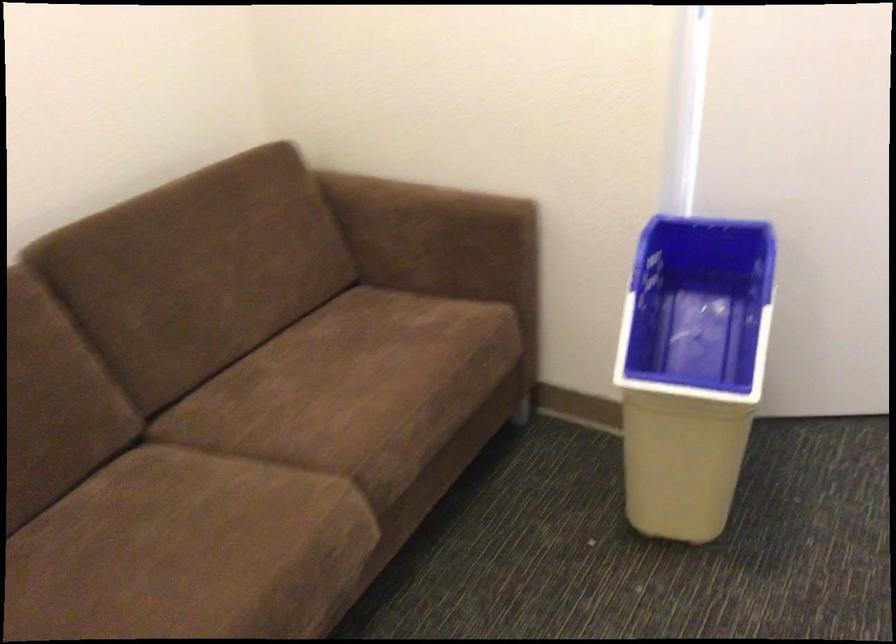
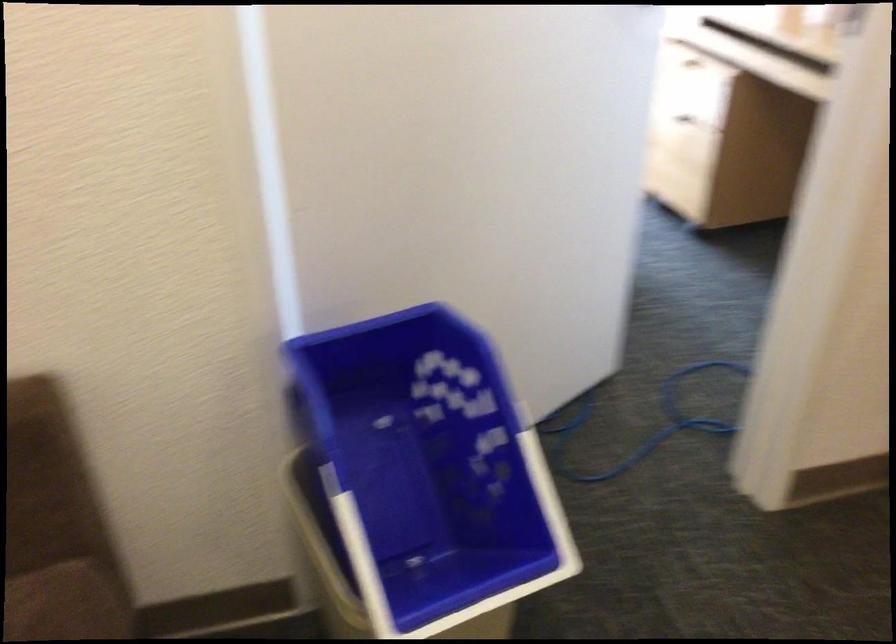
Question: The first image is from the beginning of the video and the second image is from the end. How did the camera likely rotate when shooting the video?

Choices:
 (A) Left
 (B) Right
 (C) Up
 (D) Down

Answer: (B)